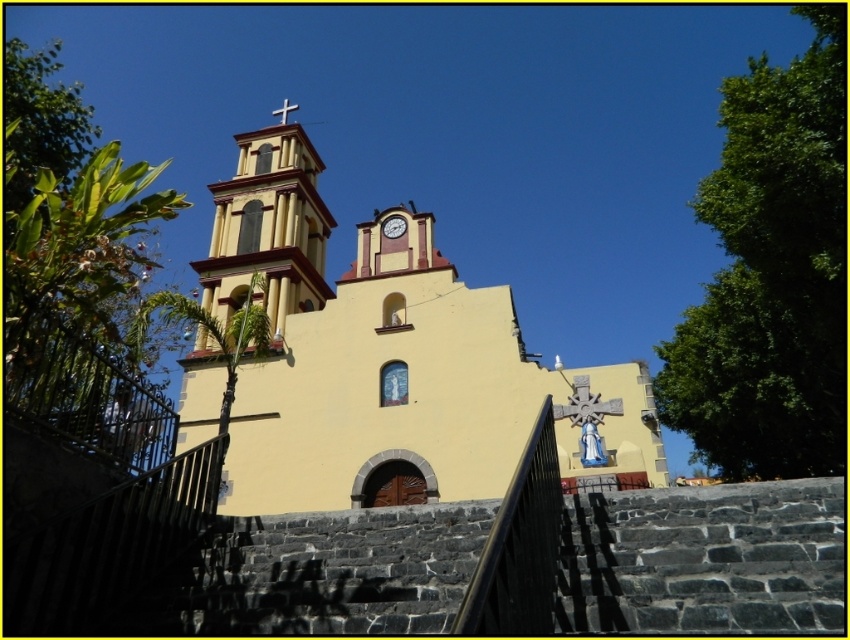
You are standing in front of the church and want to locate the yellow stucco bell tower at upper left and the metallic cross at upper center. From your perspective, which object is positioned to the right side?

The yellow stucco bell tower at upper left is to the right of the metallic cross at upper center, so the yellow stucco bell tower at upper left is positioned to the right side.